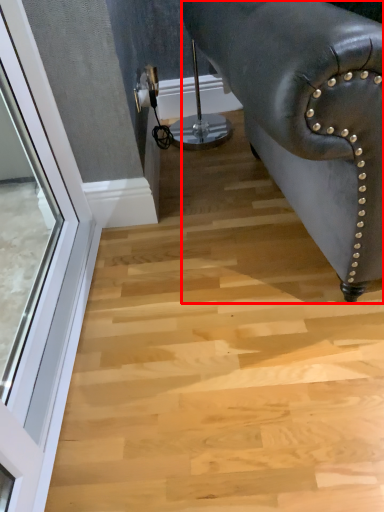
Question: From the image's perspective, where is furniture (annotated by the red box) located in relation to window in the image?

Choices:
 (A) below
 (B) above

Answer: (B)